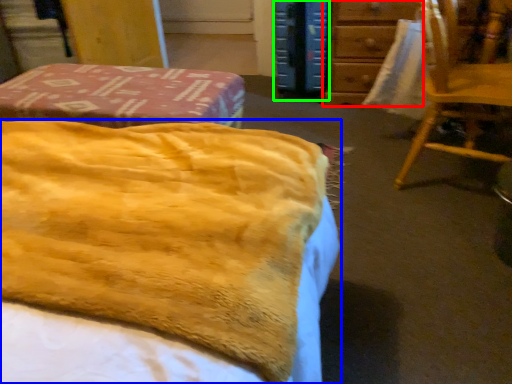
Question: Considering the real-world distances, which object is closest to furniture (highlighted by a red box)? bed (highlighted by a blue box) or paperback book (highlighted by a green box).

Choices:
 (A) bed
 (B) paperback book

Answer: (B)